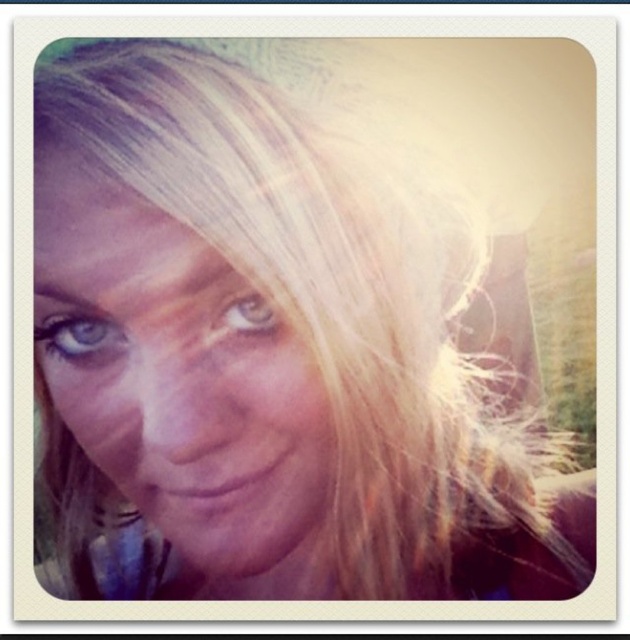
You are a photographer analyzing this image. You notice the smooth skin face at center and the brown matte eye at center. Which object is located to the right in the image?

The brown matte eye at center is located to the right of the smooth skin face at center because the smooth skin face at center is positioned on the left side of brown matte eye at center.